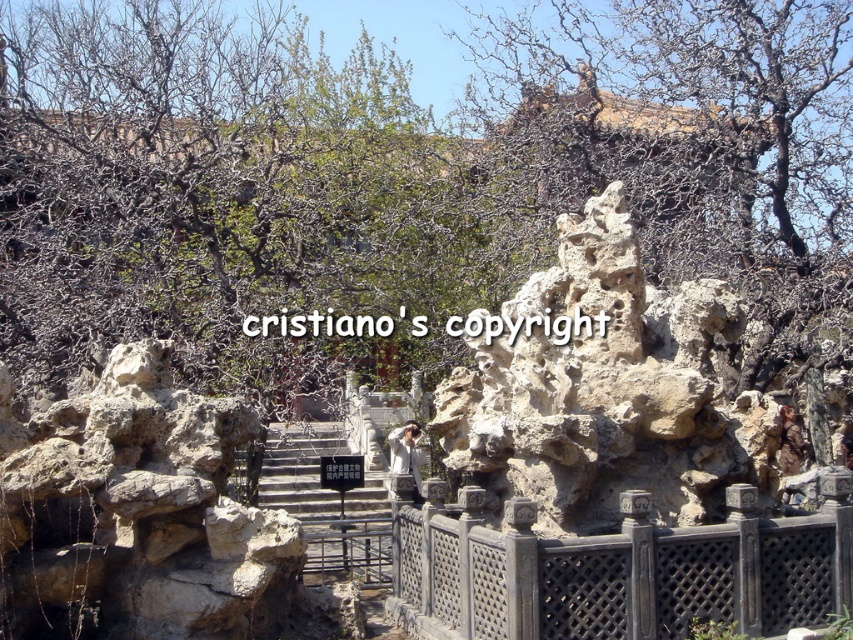
Question: Can you confirm if natural stone rock formation at center is thinner than stone stairs at center?

Choices:
 (A) yes
 (B) no

Answer: (B)

Question: Which point appears farthest from the camera in this image?

Choices:
 (A) (309, 460)
 (B) (498, 452)

Answer: (A)

Question: Which point is farther to the camera?

Choices:
 (A) (477, 627)
 (B) (265, 444)

Answer: (B)

Question: Among these points, which one is farthest from the camera?

Choices:
 (A) (331, 531)
 (B) (515, 308)
 (C) (642, 572)

Answer: (A)

Question: Is natural stone rock formation at center thinner than black stone fence at lower right?

Choices:
 (A) no
 (B) yes

Answer: (B)

Question: Is natural stone rock formation at center to the right of black stone fence at lower right from the viewer's perspective?

Choices:
 (A) no
 (B) yes

Answer: (B)